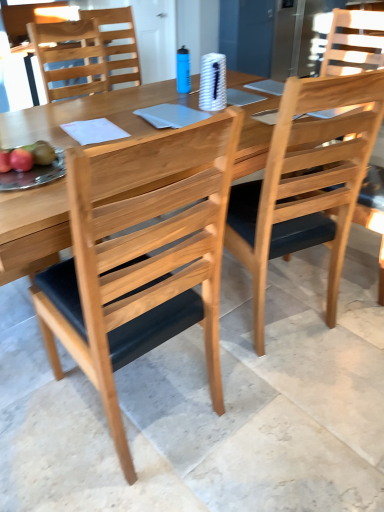
Identify the location of free location to the right of natural wood chair at center, placed as the third chair when sorted from back to front. This screenshot has height=512, width=384. (254, 406).